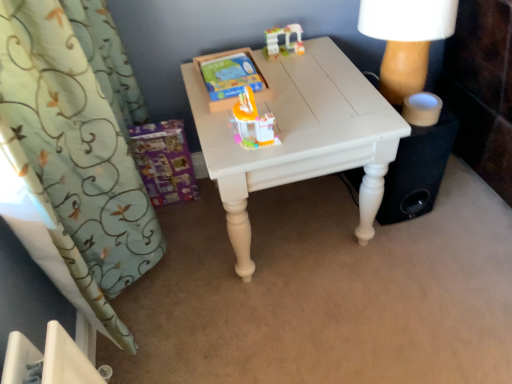
Locate an element on the screen. empty space that is to the right of white painted wood table at center is located at coordinates (439, 259).